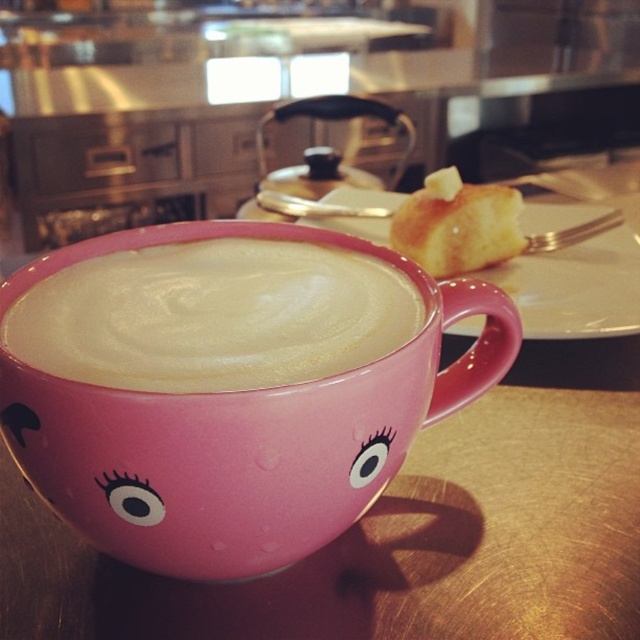
Which of these two, pink glossy mug at center or buttery golden bread at upper right, stands taller?

pink glossy mug at center is taller.

Is point (284, 228) in front of point (449, 186)?

Yes, point (284, 228) is in front of point (449, 186).

The height and width of the screenshot is (640, 640). Identify the location of pink glossy mug at center. (241, 428).

Which of these two, pink glossy mug at center or white matte plate at upper center, stands taller?

white matte plate at upper center

Does point (170, 420) come closer to viewer compared to point (595, 330)?

Yes, it is in front of point (595, 330).

The width and height of the screenshot is (640, 640). What do you see at coordinates (241, 428) in the screenshot? I see `pink glossy mug at center` at bounding box center [241, 428].

Locate an element on the screen. This screenshot has width=640, height=640. pink glossy mug at center is located at coordinates (241, 428).

Does matte pink cup at center appear over white matte plate at upper center?

Incorrect, matte pink cup at center is not positioned above white matte plate at upper center.

Between point (116, 355) and point (634, 323), which one is positioned behind?

The point (634, 323) is more distant.

This screenshot has width=640, height=640. In order to click on matte pink cup at center in this screenshot , I will do `click(212, 316)`.